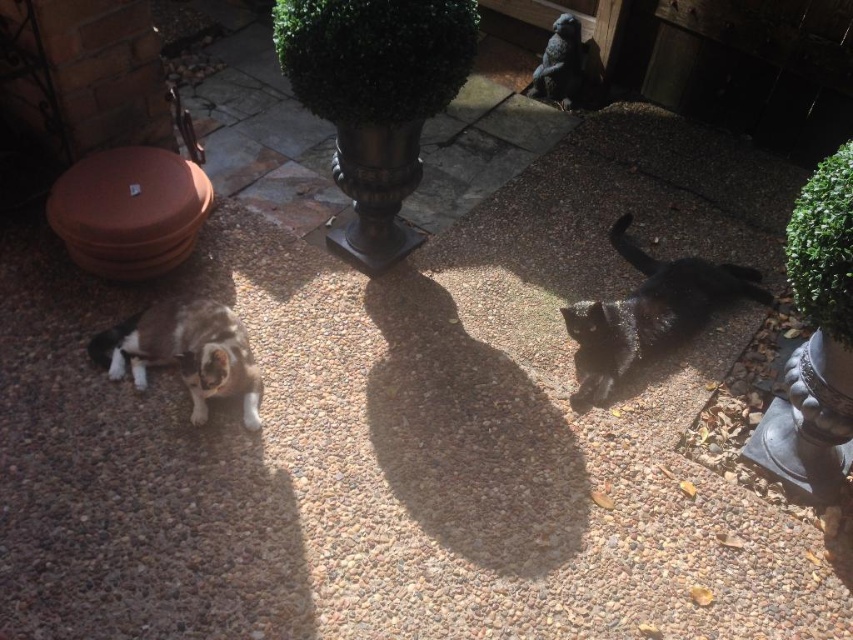
Question: Can you confirm if black glossy cat at right is smaller than calico fur cat at lower left?

Choices:
 (A) no
 (B) yes

Answer: (A)

Question: Which object is farther from the camera taking this photo?

Choices:
 (A) black glossy cat at right
 (B) calico fur cat at lower left

Answer: (A)

Question: Which point is farther from the camera taking this photo?

Choices:
 (A) (587, 392)
 (B) (131, 369)

Answer: (A)

Question: Which of the following is the farthest from the observer?

Choices:
 (A) (248, 360)
 (B) (595, 387)

Answer: (B)

Question: Is black glossy cat at right bigger than calico fur cat at lower left?

Choices:
 (A) yes
 (B) no

Answer: (A)

Question: Can you confirm if black glossy cat at right is bigger than calico fur cat at lower left?

Choices:
 (A) yes
 (B) no

Answer: (A)